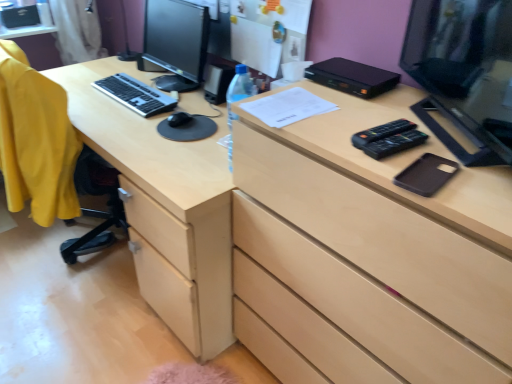
Identify the location of vacant space that's between black matte mouse at center and silver metallic keyboard at center-left. (166, 109).